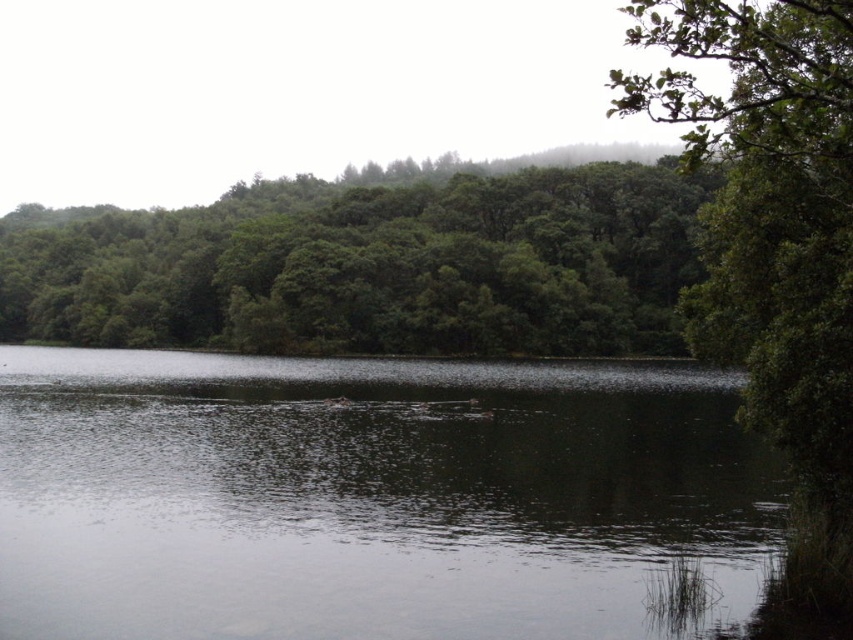
Which is below, dark reflective water at center or green leafy trees at center?

dark reflective water at center

Based on the photo, between dark reflective water at center and green leafy trees at center, which one has less height?

dark reflective water at center

What do you see at coordinates (368, 499) in the screenshot?
I see `dark reflective water at center` at bounding box center [368, 499].

Identify the location of dark reflective water at center. (368, 499).